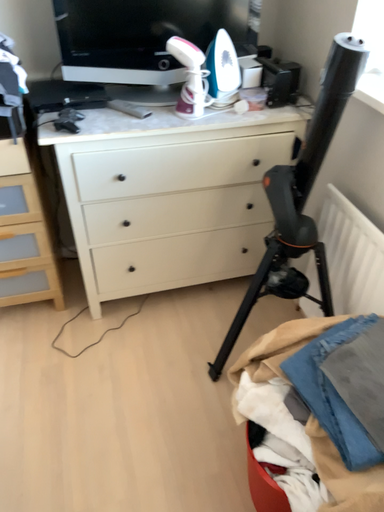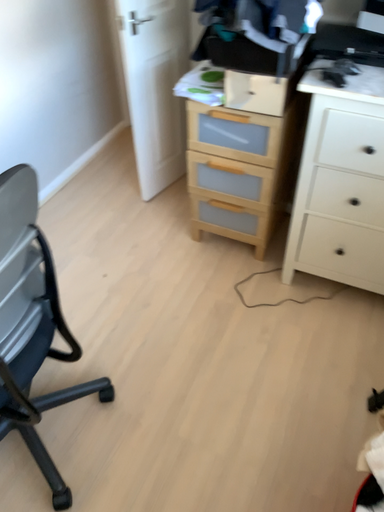
Question: Which way did the camera rotate in the video?

Choices:
 (A) rotated left
 (B) rotated right

Answer: (A)